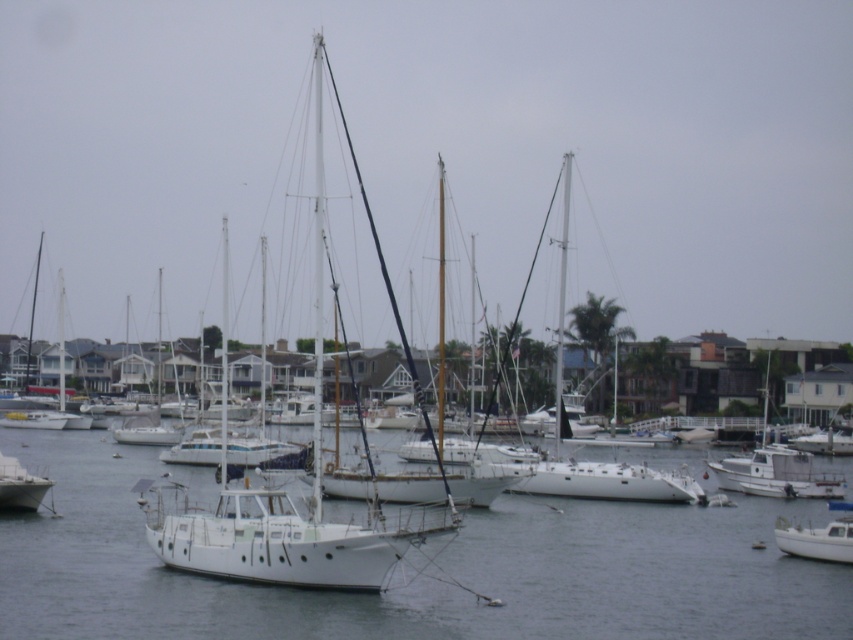
You are a tour guide leading a group of visitors to the marina. You want to show them the two boats mentioned. How far apart are the white matte boat at lower right and the white matte sailboat at lower left?

The white matte boat at lower right and the white matte sailboat at lower left are 22.22 meters apart from each other.

You are standing at the edge of the marina and see two points in the scene. The first point is labeled as point (752, 611) and the second is point (839, 518). Which of these points is nearer to your current position?

Point (752, 611) is closer to the viewer than point (839, 518), so the first point is nearer to your current position.

You are standing at the edge of the marina, looking out at the boats and the surrounding area. There are two points marked on a map of the scene. One is labeled as point (750, 474) and the other as point (1, 488). Which of these two points is closer to you from your current viewpoint?

Point (1, 488) is closer to you because it is in front of point (750, 474), which is behind it.